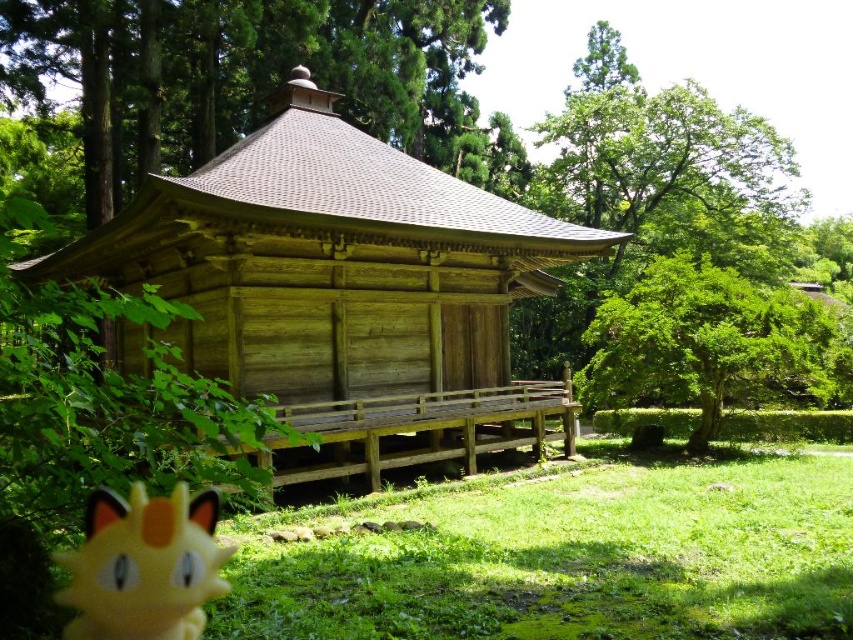
Question: Which point is closer to the camera?

Choices:
 (A) (428, 45)
 (B) (563, 588)
 (C) (828, 333)

Answer: (B)

Question: Which point is farther to the camera?

Choices:
 (A) (212, 561)
 (B) (721, 349)
 (C) (350, 513)
 (D) (186, 113)

Answer: (D)

Question: Which of the following is the farthest from the observer?

Choices:
 (A) green grass at lower center
 (B) wooden hut at center

Answer: (B)

Question: In this image, where is green textured tree at upper left located relative to yellow plush toy at lower left?

Choices:
 (A) above
 (B) below

Answer: (A)

Question: Does wooden hut at center have a greater width compared to green grass at lower center?

Choices:
 (A) yes
 (B) no

Answer: (A)

Question: From the image, what is the correct spatial relationship of wooden hut at center in relation to green leafy tree at center?

Choices:
 (A) left
 (B) right

Answer: (A)